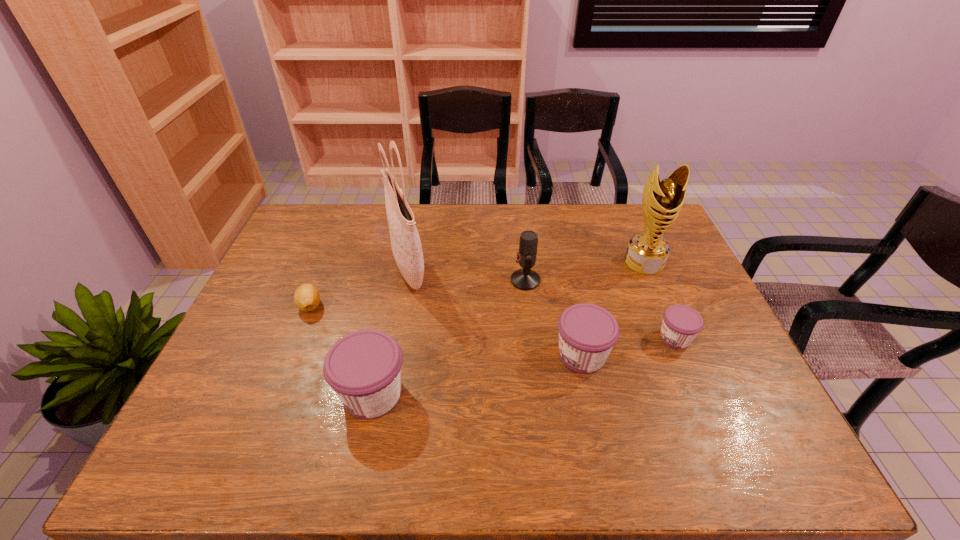
What are the coordinates of `free space between the award and the fourth object from right to left` in the screenshot? It's located at (585, 271).

Find the location of a particular element. This screenshot has height=540, width=960. vacant point located between the rightmost jam and the leftmost jam is located at coordinates (524, 366).

What are the coordinates of `vacant space that's between the leftmost jam and the second tallest object` in the screenshot? It's located at pos(509,328).

This screenshot has width=960, height=540. I want to click on empty space that is in between the sixth shortest object and the rightmost jam, so click(660, 300).

Identify the location of empty location between the tallest object and the second shortest object. (541, 303).

In order to click on free space between the third tallest object and the second jam from right to left in this screenshot , I will do `click(554, 318)`.

Select which object appears as the sixth closest to the third object from right to left. Please provide its 2D coordinates. Your answer should be formatted as a tuple, i.e. [(x, y)], where the tuple contains the x and y coordinates of a point satisfying the conditions above.

[(306, 297)]

Locate which object ranks fifth in proximity to the fourth object from left to right. Please provide its 2D coordinates. Your answer should be formatted as a tuple, i.e. [(x, y)], where the tuple contains the x and y coordinates of a point satisfying the conditions above.

[(363, 367)]

Locate an element on the screen. This screenshot has height=540, width=960. the second closest jam to the second jam from right to left is located at coordinates (363, 367).

You are a GUI agent. You are given a task and a screenshot of the screen. Output one action in this format:
    pyautogui.click(x=<x>, y=<y>)
    Task: Click on the jam that is the closest to the third tallest object
    Image resolution: width=960 pixels, height=540 pixels.
    Given the screenshot: What is the action you would take?
    pyautogui.click(x=587, y=333)